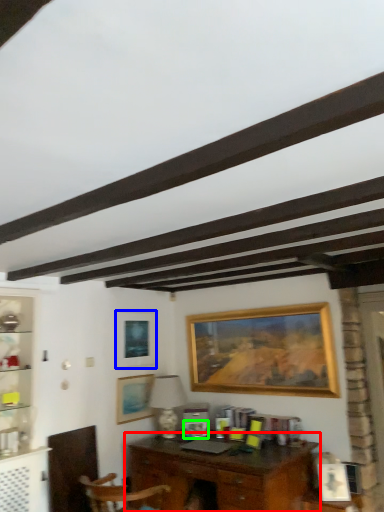
Question: Estimate the real-world distances between objects in this image. Which object is closer to desk (highlighted by a red box), picture frame (highlighted by a blue box) or picture frame (highlighted by a green box)?

Choices:
 (A) picture frame
 (B) picture frame

Answer: (B)